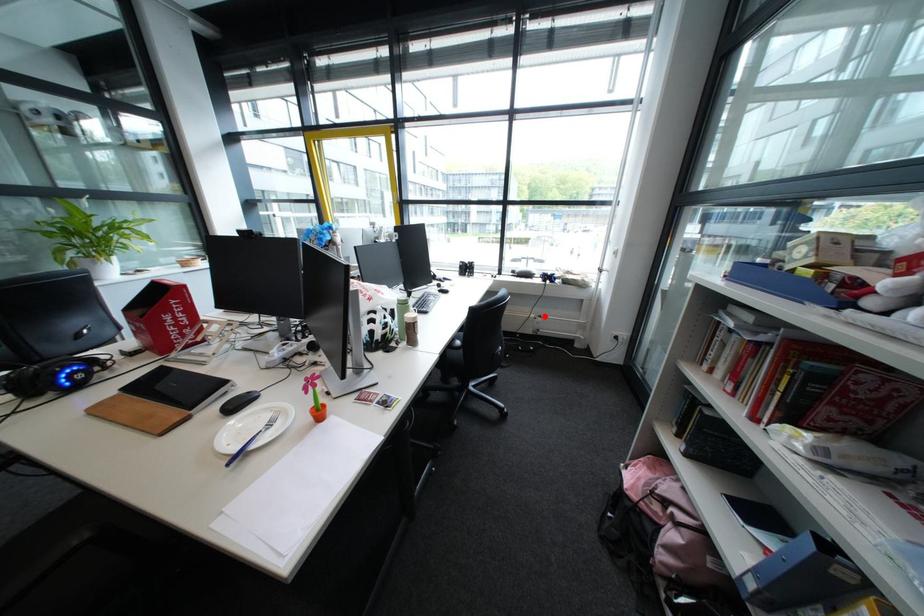
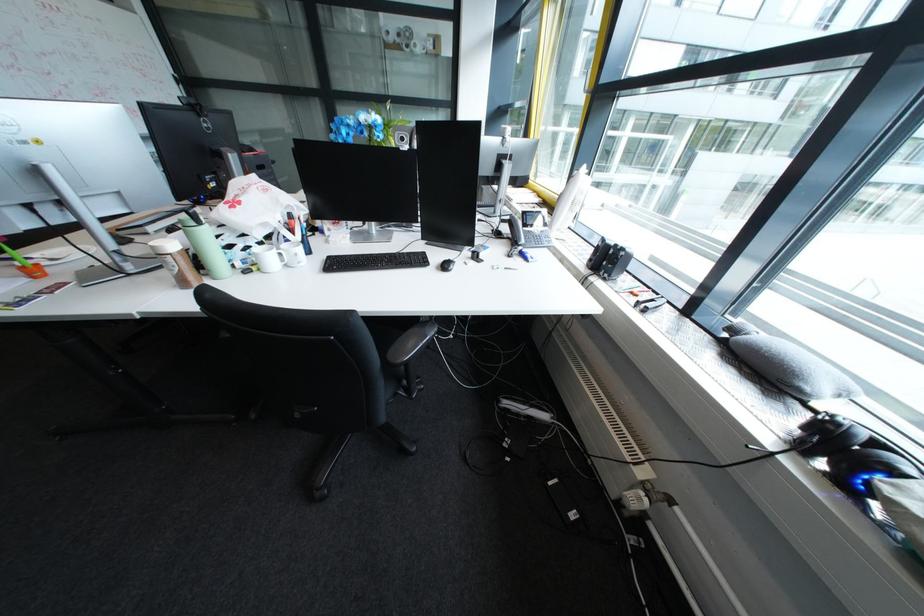
The point at the highlighted location is marked in the first image. Where is the corresponding point in the second image?

(646, 467)